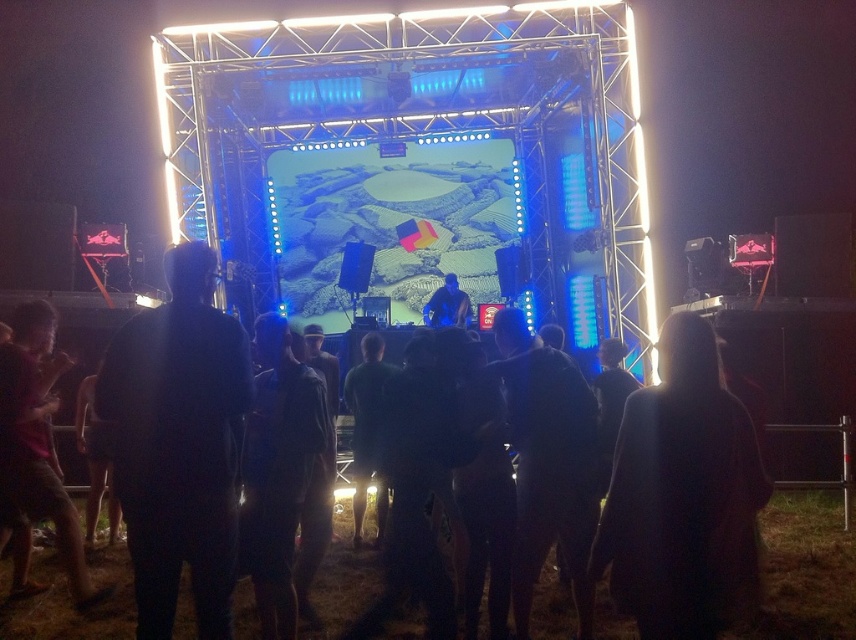
Question: Is dark fabric jacket at center closer to camera compared to dark fabric coat at center?

Choices:
 (A) no
 (B) yes

Answer: (A)

Question: Is dark fabric jacket at center positioned before blue fabric dj booth at center?

Choices:
 (A) yes
 (B) no

Answer: (A)

Question: Which point appears closest to the camera in this image?

Choices:
 (A) [99, 381]
 (B) [467, 314]
 (C) [745, 573]

Answer: (C)

Question: Which of these objects is positioned closest to the dark fabric coat at center?

Choices:
 (A) dark red shirt at left
 (B) dark fabric jacket at center
 (C) blue fabric dj booth at center

Answer: (B)

Question: Does dark fabric jacket at center have a larger size compared to blue fabric dj booth at center?

Choices:
 (A) no
 (B) yes

Answer: (B)

Question: Which object is closer to the camera taking this photo?

Choices:
 (A) dark red shirt at left
 (B) blue fabric dj booth at center

Answer: (A)